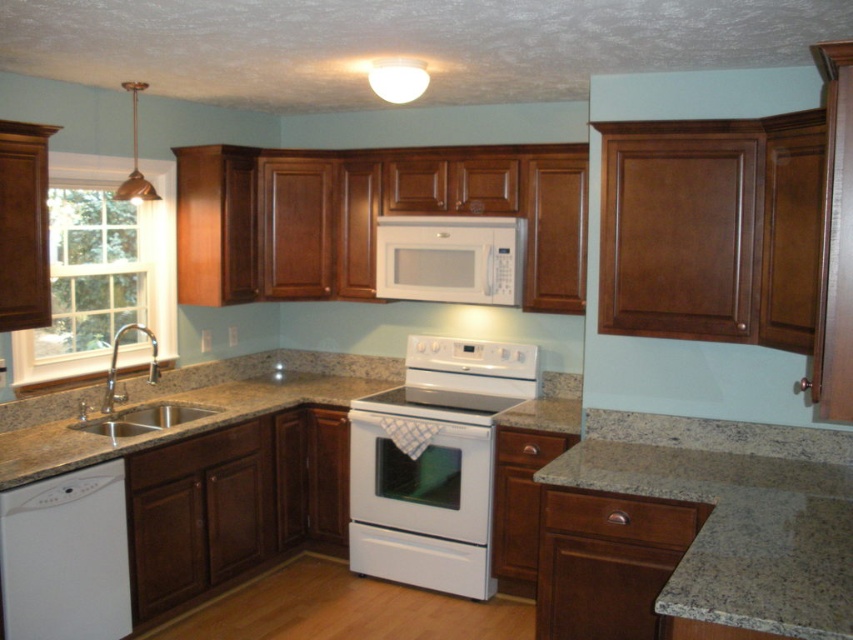
You are a kitchen designer planning to install a new appliance between the white glossy dishwasher at lower left and the brown granite sink at lower left. The appliance requires a minimum of 28 inches of space. Can the existing space accommodate this appliance?

The white glossy dishwasher at lower left and brown granite sink at lower left are 30.00 inches apart. Since the required space is 28 inches, the existing space can accommodate the appliance.

What is the spatial relationship between the white matte microwave at upper center and the brown granite sink at lower left in terms of width?

The white matte microwave at upper center might be wider than the brown granite sink at lower left.